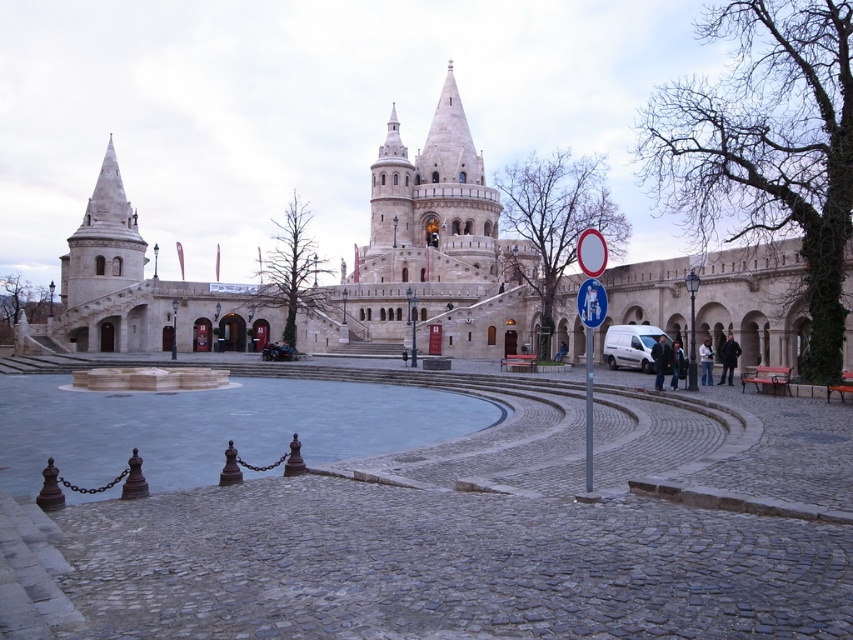
This screenshot has width=853, height=640. Describe the element at coordinates (103, 241) in the screenshot. I see `white stone tower at left` at that location.

Is white stone tower at left to the left of light blue jeans at center from the viewer's perspective?

Correct, you'll find white stone tower at left to the left of light blue jeans at center.

Does point (126, 216) lie behind point (701, 356)?

Yes, point (126, 216) is behind point (701, 356).

This screenshot has width=853, height=640. I want to click on white stone tower at left, so click(x=103, y=241).

In the scene shown: Does metallic blue sign at center have a lesser height compared to dark blue jacket at center?

No.

Who is more forward, (585,419) or (654,371)?

Point (585,419)

Find the location of a particular element. This screenshot has height=640, width=853. metallic blue sign at center is located at coordinates (590, 317).

Which is more to the left, blue plastic sign at center or light blue jeans at center?

blue plastic sign at center

Between blue plastic sign at center and light blue jeans at center, which one appears on the right side from the viewer's perspective?

light blue jeans at center is more to the right.

Is point (587, 280) closer to viewer compared to point (705, 355)?

That is True.

This screenshot has width=853, height=640. Identify the location of blue plastic sign at center. (590, 301).